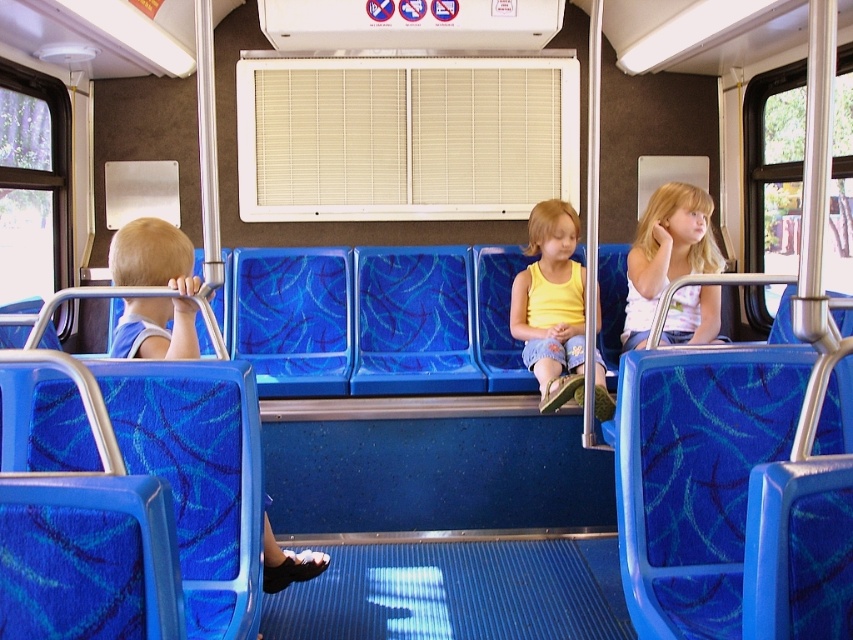
You are a passenger on a bus and you see a yellow cotton tank top at center and a light blue fabric seat at left. Which item is wider?

The yellow cotton tank top at center is wider than the light blue fabric seat at left.